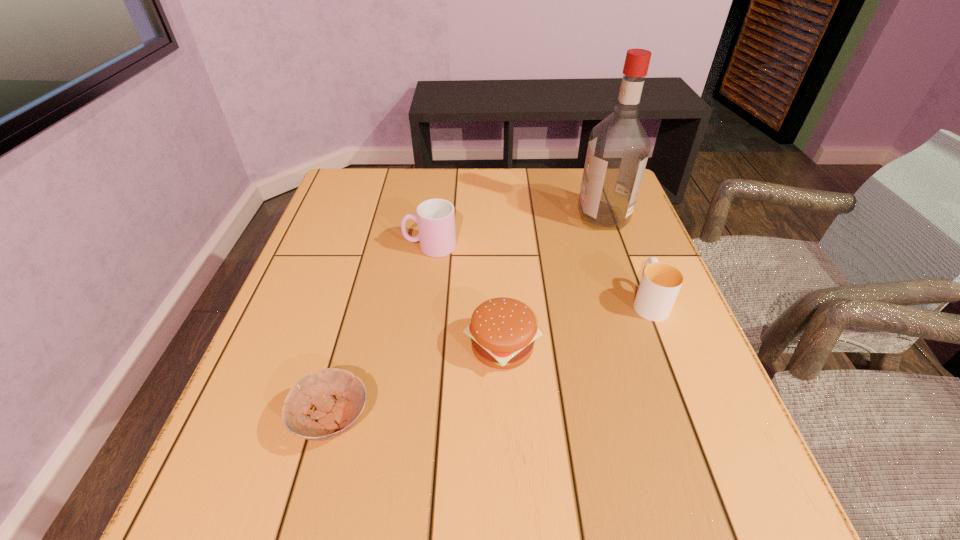
You are a GUI agent. You are given a task and a screenshot of the screen. Output one action in this format:
    pyautogui.click(x=<x>, y=<y>)
    Task: Click on the farthest object
    
    Given the screenshot: What is the action you would take?
    pyautogui.click(x=618, y=148)

Where is `liquor`? liquor is located at coordinates point(618,148).

Where is `the farther cup`? The width and height of the screenshot is (960, 540). the farther cup is located at coordinates (435, 218).

Image resolution: width=960 pixels, height=540 pixels. What are the coordinates of `the fourth nearest object` in the screenshot? It's located at (435, 218).

The width and height of the screenshot is (960, 540). I want to click on the nearer cup, so click(661, 282).

Locate an element on the screen. The image size is (960, 540). the shorter cup is located at coordinates (661, 282).

The height and width of the screenshot is (540, 960). What are the coordinates of `the third object from left to right` in the screenshot? It's located at (503, 331).

Identify the location of the nearest object. (334, 417).

Find the location of a particular element. This screenshot has height=540, width=960. bowl is located at coordinates (334, 417).

What are the coordinates of `vacant space located on the front-facing side of the tallest object` in the screenshot? It's located at (444, 217).